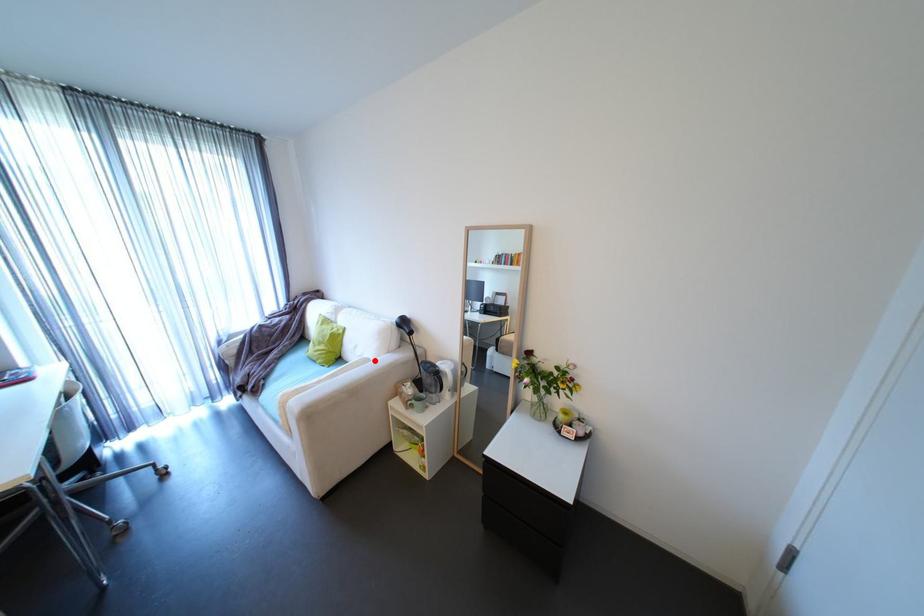
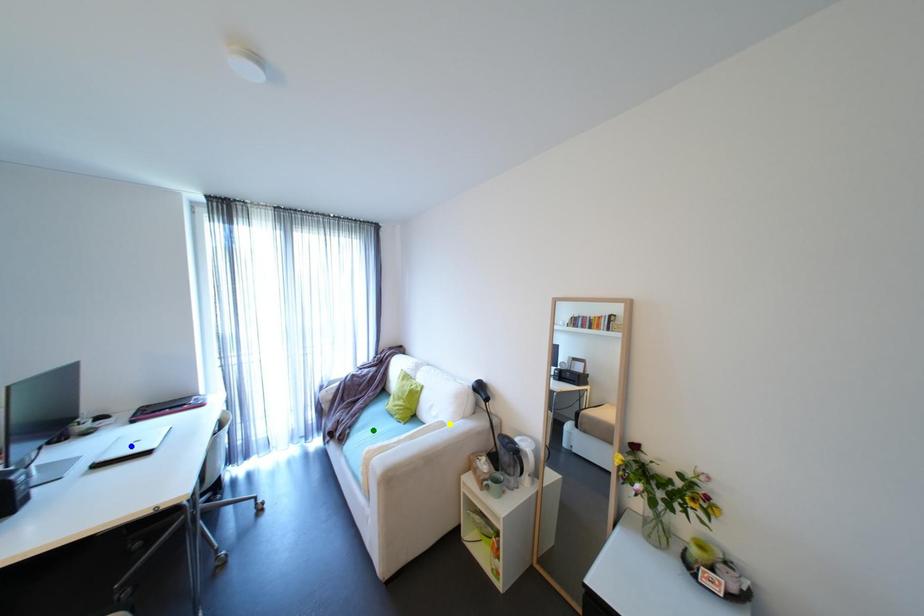
Question: I am providing you with two images of the same scene from different viewpoints. A red point is marked on the first image. You are given multiple points on the second image. Which spot in image 2 lines up with the point in image 1?

Choices:
 (A) green point
 (B) blue point
 (C) yellow point

Answer: (C)